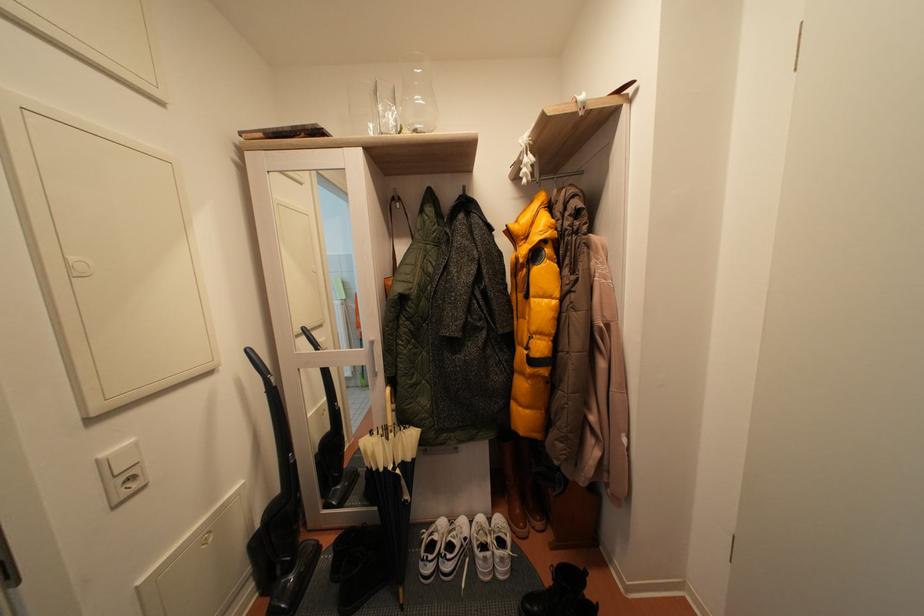
Find where to grip the umbrella handle. Please return your answer as a coordinate pair (x, y).

(390, 418)